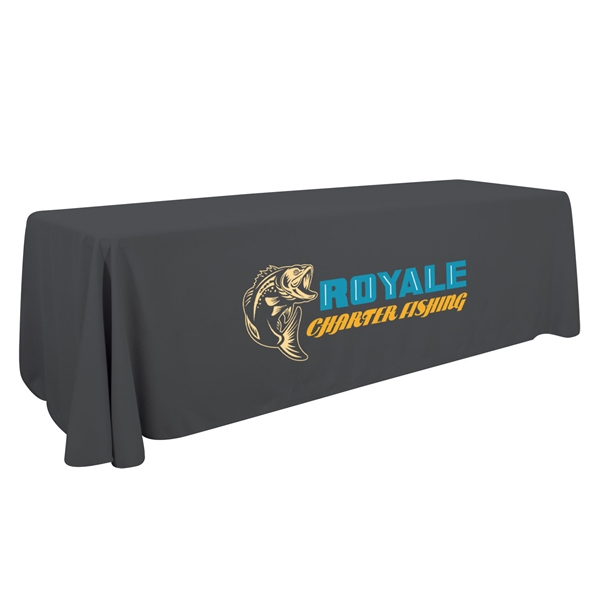
Locate an element on the screen. This screenshot has height=600, width=600. table is located at coordinates (318, 198).